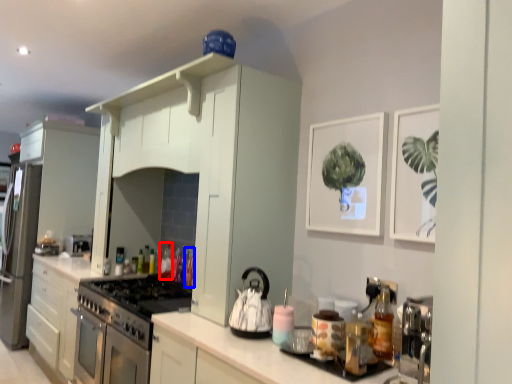
Question: Which object is further to the camera taking this photo, bottle (highlighted by a red box) or bottle (highlighted by a blue box)?

Choices:
 (A) bottle
 (B) bottle

Answer: (A)